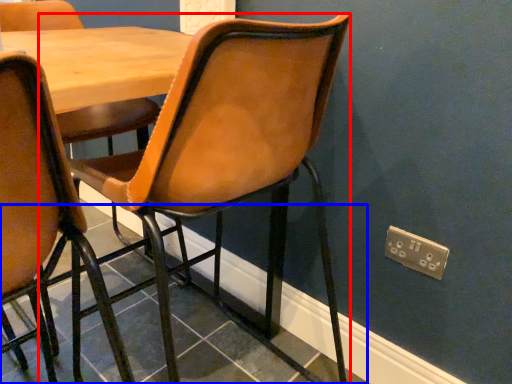
Question: Which object appears closest to the camera in this image, chair (highlighted by a red box) or tile (highlighted by a blue box)?

Choices:
 (A) chair
 (B) tile

Answer: (A)